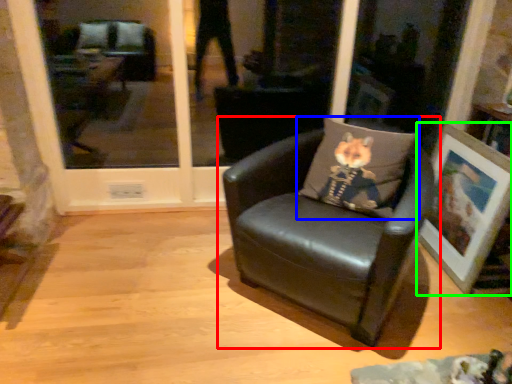
Question: Considering the real-world distances, which object is closest to chair (highlighted by a red box)? pillow (highlighted by a blue box) or picture frame (highlighted by a green box).

Choices:
 (A) pillow
 (B) picture frame

Answer: (A)